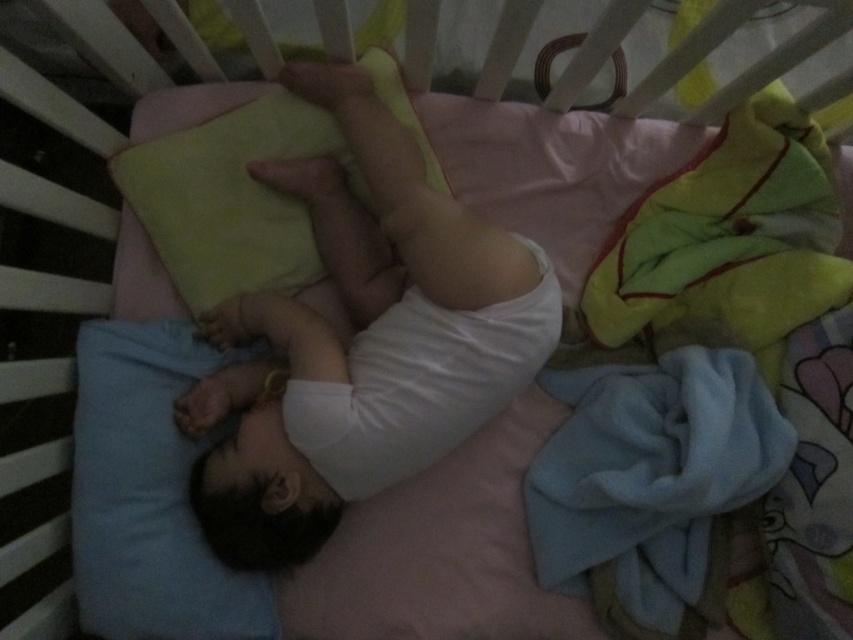
Between point (410, 205) and point (527, 323), which one is positioned behind?

The point (527, 323) is behind.

Can you confirm if white soft baby at center is positioned above white cloth diaper at center?

Correct, white soft baby at center is located above white cloth diaper at center.

Is point (430, 358) positioned in front of point (328, 410)?

No, (430, 358) is behind (328, 410).

Where is `white soft baby at center`? The image size is (853, 640). white soft baby at center is located at coordinates (363, 340).

Can you confirm if blue soft pillow at lower left is positioned to the right of white cloth diaper at center?

In fact, blue soft pillow at lower left is to the left of white cloth diaper at center.

Who is lower down, blue soft pillow at lower left or white cloth diaper at center?

blue soft pillow at lower left is lower down.

Who is more forward, (152, 604) or (289, 380)?

Point (152, 604)

Locate an element on the screen. The width and height of the screenshot is (853, 640). blue soft pillow at lower left is located at coordinates (149, 492).

How far apart are white soft baby at center and blue soft pillow at lower left?

white soft baby at center is 5.50 inches from blue soft pillow at lower left.

Does white soft baby at center appear on the right side of blue soft pillow at lower left?

Indeed, white soft baby at center is positioned on the right side of blue soft pillow at lower left.

Who is more forward, (367,396) or (199,595)?

Point (199,595) is more forward.

The image size is (853, 640). I want to click on white soft baby at center, so click(363, 340).